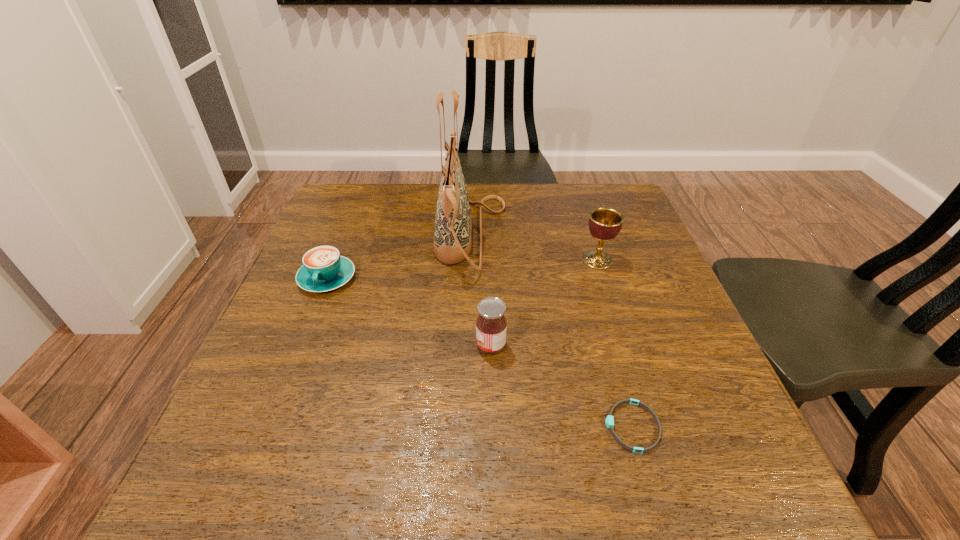
Where is `vacant area located on the label side of the second nearest object`? The image size is (960, 540). vacant area located on the label side of the second nearest object is located at coordinates (376, 346).

Locate an element on the screen. This screenshot has height=540, width=960. free region located on the label side of the second nearest object is located at coordinates (401, 346).

At what (x,y) coordinates should I click in order to perform the action: click on free spot located on the label side of the second nearest object. Please return your answer as a coordinate pair (x, y). This screenshot has width=960, height=540. Looking at the image, I should click on (276, 346).

The height and width of the screenshot is (540, 960). Identify the location of vacant space located with the handle on the right side of the fourth tallest object. (254, 462).

Find the location of a particular element. free region located 0.180m on the buckle of the wristband is located at coordinates (500, 427).

Locate an element on the screen. vacant space located 0.260m on the buckle of the wristband is located at coordinates (453, 427).

Where is `blank space located 0.260m on the buckle of the wristband`? blank space located 0.260m on the buckle of the wristband is located at coordinates (453, 427).

Identify the location of object positioned at the far edge. The image size is (960, 540). (453, 224).

Identify the location of object located in the near edge section of the desktop. The image size is (960, 540). (609, 420).

This screenshot has height=540, width=960. What are the coordinates of `object at the left edge` in the screenshot? It's located at (323, 269).